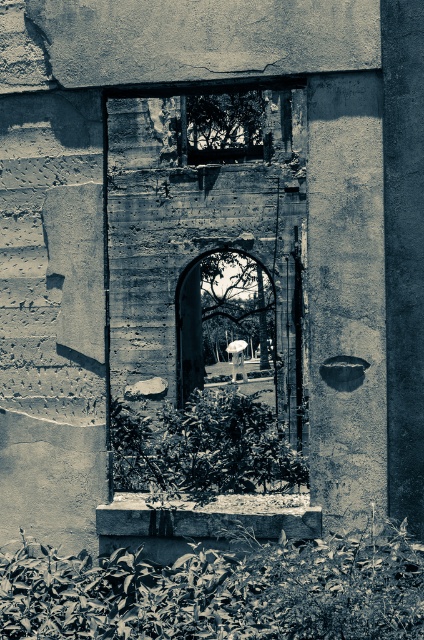
Can you confirm if leathery green leaves at lower center is positioned to the left of transparent glass window at upper center?

In fact, leathery green leaves at lower center is to the right of transparent glass window at upper center.

Can you confirm if leathery green leaves at lower center is taller than transparent glass window at upper center?

In fact, leathery green leaves at lower center may be shorter than transparent glass window at upper center.

Between point (301, 609) and point (186, 154), which one is positioned behind?

The point (186, 154) is more distant.

Find the location of a particular element. leathery green leaves at lower center is located at coordinates (220, 592).

Who is positioned more to the right, green leafy plant at center or transparent glass window at upper center?

Positioned to the right is transparent glass window at upper center.

Who is more forward, [251,458] or [195,147]?

Point [251,458]

Where is `green leafy plant at center`? This screenshot has width=424, height=640. green leafy plant at center is located at coordinates (204, 445).

Measure the distance between leathery green leaves at lower center and smooth stone archway at center.

leathery green leaves at lower center and smooth stone archway at center are 50.19 feet apart from each other.

The width and height of the screenshot is (424, 640). In order to click on leathery green leaves at lower center in this screenshot , I will do `click(220, 592)`.

The image size is (424, 640). In order to click on leathery green leaves at lower center in this screenshot , I will do `click(220, 592)`.

I want to click on leathery green leaves at lower center, so click(220, 592).